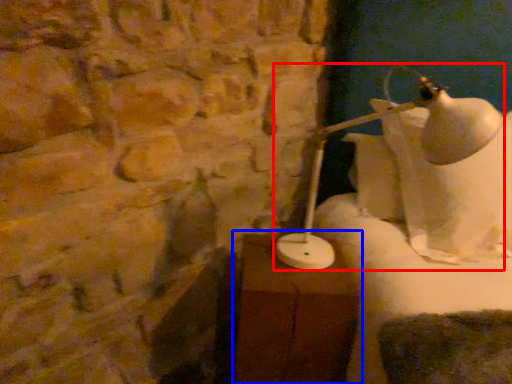
Question: Which object appears farthest to the camera in this image, lamp (highlighted by a red box) or table (highlighted by a blue box)?

Choices:
 (A) lamp
 (B) table

Answer: (A)